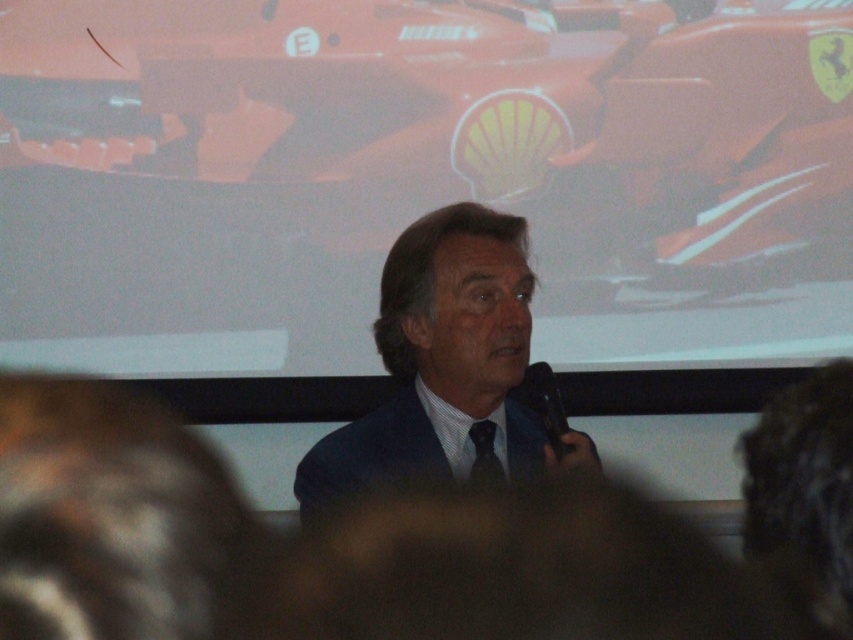
Between dark blue suit at center and black satin tie at center, which one has less height?

black satin tie at center is shorter.

Measure the distance between dark blue suit at center and camera.

They are 2.15 meters apart.

At what (x,y) coordinates should I click in order to perform the action: click on dark blue suit at center. Please return your answer as a coordinate pair (x, y). Looking at the image, I should click on (444, 364).

Is shiny orange car at upper center to the right of black plastic microphone at center from the viewer's perspective?

No, shiny orange car at upper center is not to the right of black plastic microphone at center.

Who is positioned more to the left, shiny orange car at upper center or black plastic microphone at center?

shiny orange car at upper center is more to the left.

The width and height of the screenshot is (853, 640). Identify the location of shiny orange car at upper center. (419, 173).

Can you confirm if shiny orange car at upper center is taller than black satin tie at center?

Correct, shiny orange car at upper center is much taller as black satin tie at center.

Who is higher up, shiny orange car at upper center or black satin tie at center?

shiny orange car at upper center

Who is more distant from viewer, [68,93] or [482,458]?

The point [68,93] is behind.

The image size is (853, 640). In order to click on shiny orange car at upper center in this screenshot , I will do `click(419, 173)`.